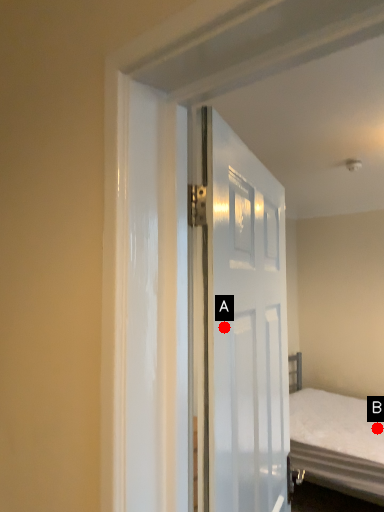
Question: Two points are circled on the image, labeled by A and B beside each circle. Which of the following is the farthest from the observer?

Choices:
 (A) A is further
 (B) B is further

Answer: (B)